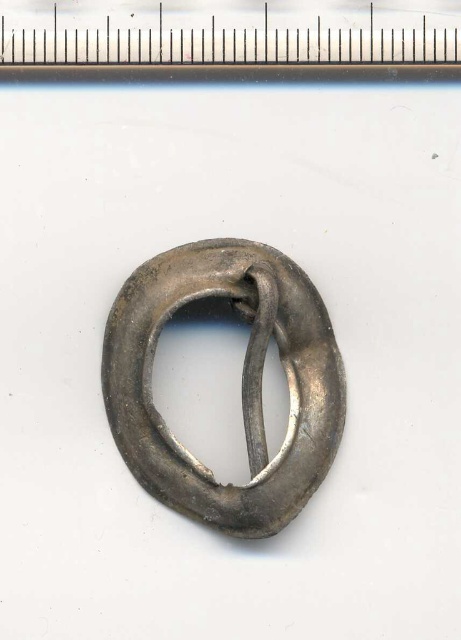
Is shiny silver ring at center further to camera compared to metallic ruler at upper center?

Yes, it is.

The image size is (461, 640). I want to click on shiny silver ring at center, so click(x=242, y=381).

The image size is (461, 640). In order to click on shiny silver ring at center in this screenshot , I will do `click(242, 381)`.